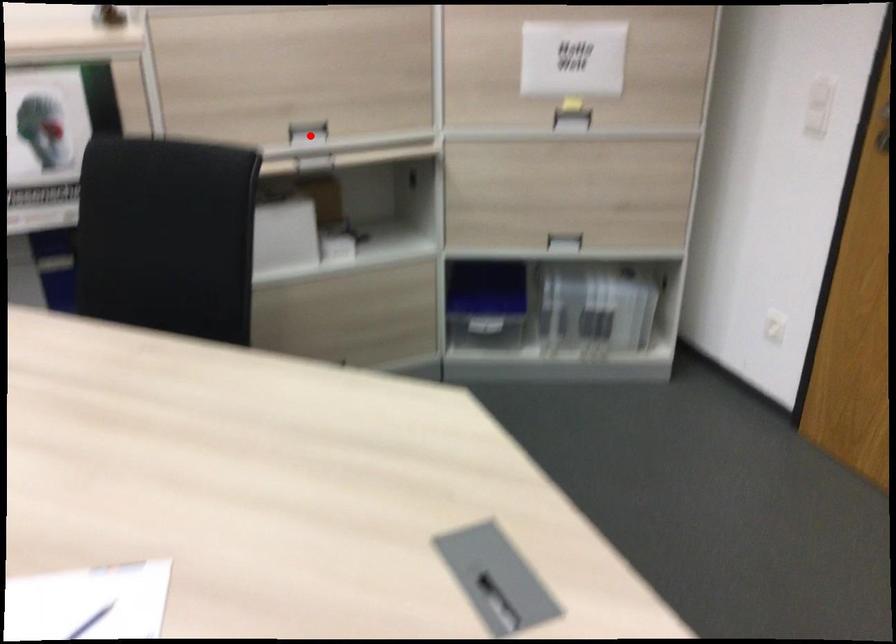
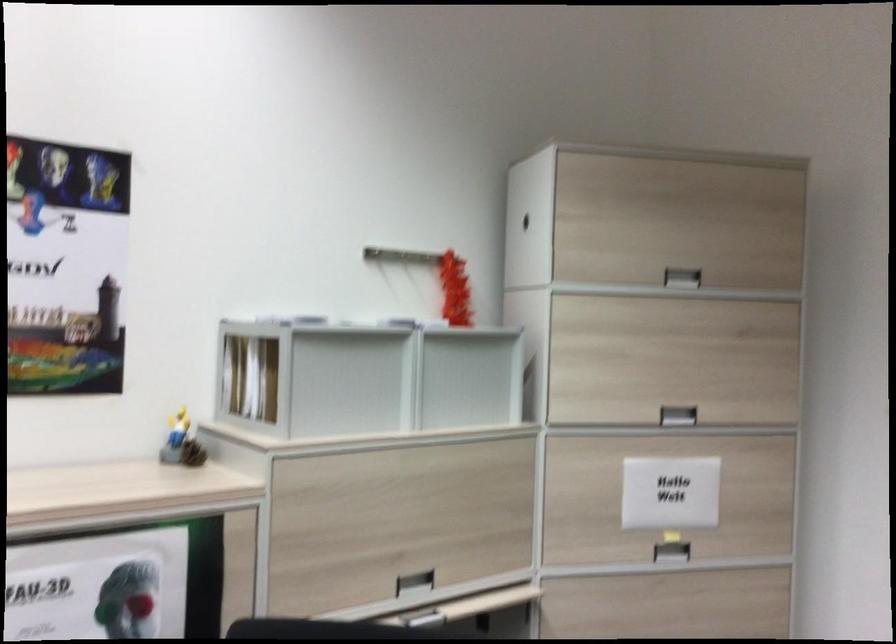
In the second image, find the point that corresponds to the highlighted location in the first image.

(415, 583)